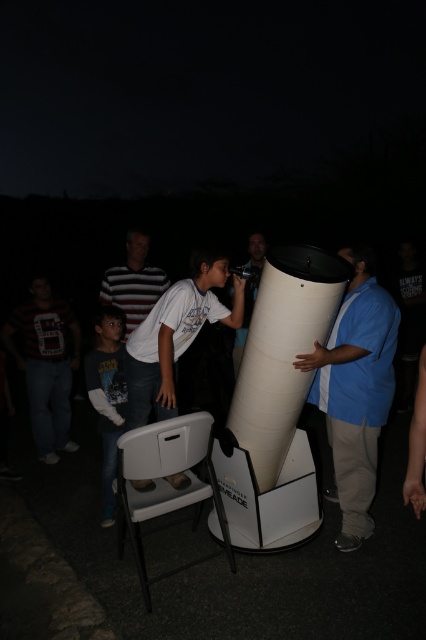
You are organizing a stargazing event and need to ensure there is enough space between the dark blue shirt at lower left and the matte black telescope at center for attendees to walk comfortably. Based on the scene description, can you determine if the space between them is sufficient for a standard wheelchair to pass through?

The dark blue shirt at lower left is wider than the matte black telescope at center, but the exact distance between them isn

You are standing at the center of the image and want to hand a star chart to the person wearing the dark blue shirt at lower left. In which direction should you move to reach them?

The dark blue shirt at lower left is located at point (x=108, y=394), so you should move to the lower left direction to reach them.